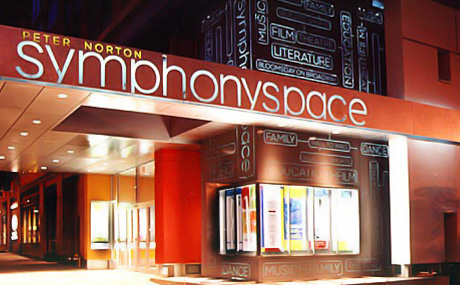
Image resolution: width=460 pixels, height=285 pixels. I want to click on art, so click(309, 56).